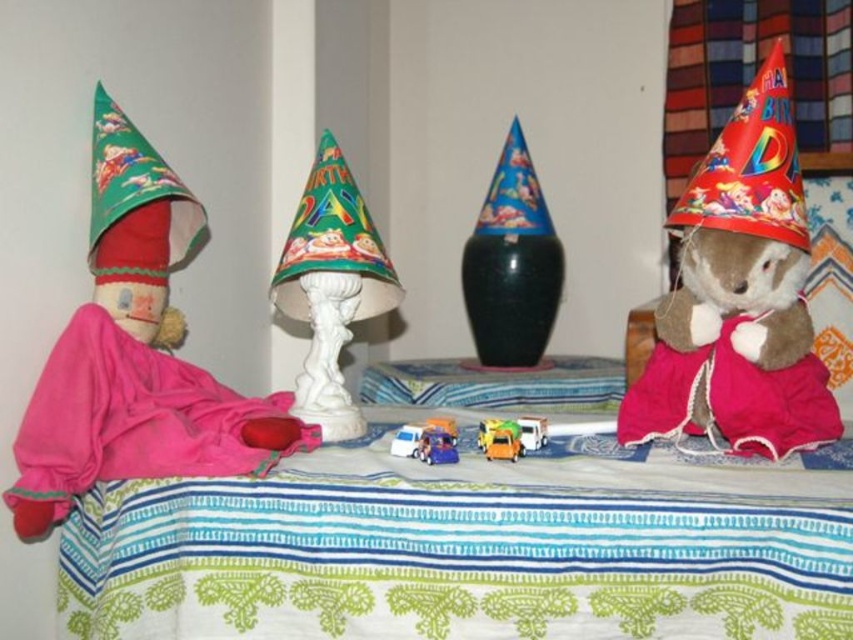
Between point (502, 429) and point (525, 444), which one is positioned in front?

Point (502, 429) is in front.

Is metallic yellow truck at center shorter than white plastic toy truck at center?

No, metallic yellow truck at center is not shorter than white plastic toy truck at center.

Does point (488, 420) lie behind point (523, 417)?

No, (488, 420) is in front of (523, 417).

Where is `metallic yellow truck at center`? This screenshot has height=640, width=853. metallic yellow truck at center is located at coordinates (498, 440).

Who is shorter, pink fabric bed at lower left or shiny red paper party hat at right?

With less height is pink fabric bed at lower left.

Which is more to the left, pink fabric bed at lower left or shiny red paper party hat at right?

Positioned to the left is pink fabric bed at lower left.

Between point (544, 524) and point (743, 195), which one is positioned behind?

The point (743, 195) is behind.

This screenshot has width=853, height=640. Identify the location of pink fabric bed at lower left. (468, 547).

Describe the element at coordinates (134, 355) in the screenshot. The height and width of the screenshot is (640, 853). I see `matte pink fabric doll at left` at that location.

Is point (45, 509) positioned after point (520, 440)?

No, (45, 509) is closer to viewer.

Is point (238, 416) closer to camera compared to point (517, 420)?

Yes.

Where is `matte pink fabric doll at left`? Image resolution: width=853 pixels, height=640 pixels. matte pink fabric doll at left is located at coordinates (134, 355).